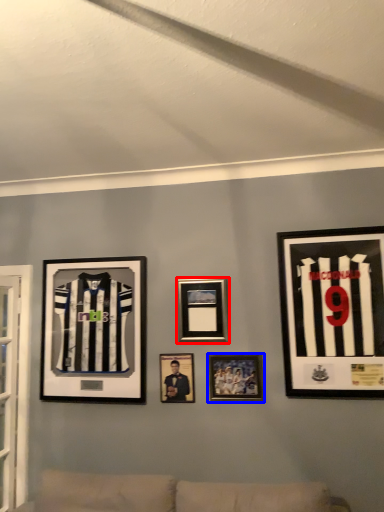
Question: Among these objects, which one is farthest to the camera, picture frame (highlighted by a red box) or picture frame (highlighted by a blue box)?

Choices:
 (A) picture frame
 (B) picture frame

Answer: (A)